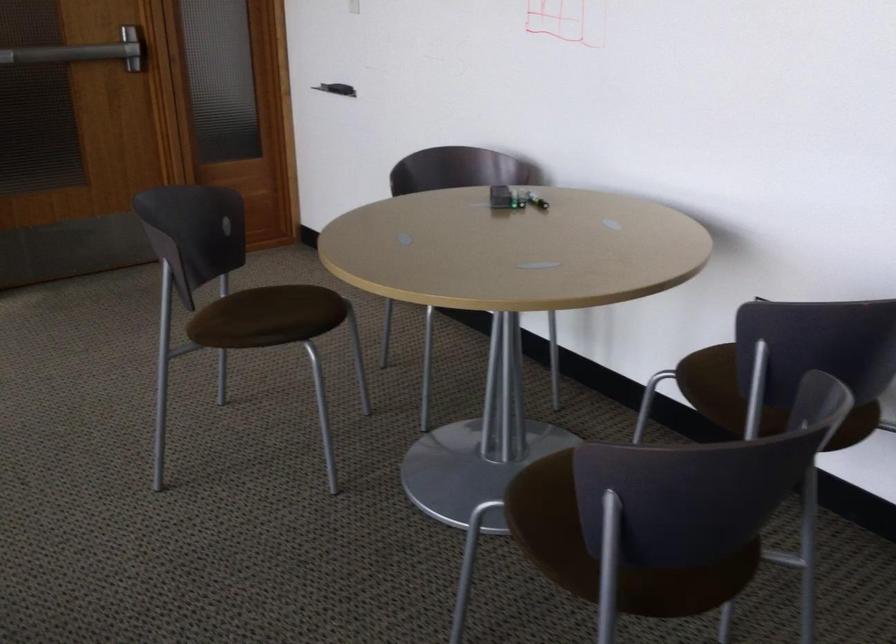
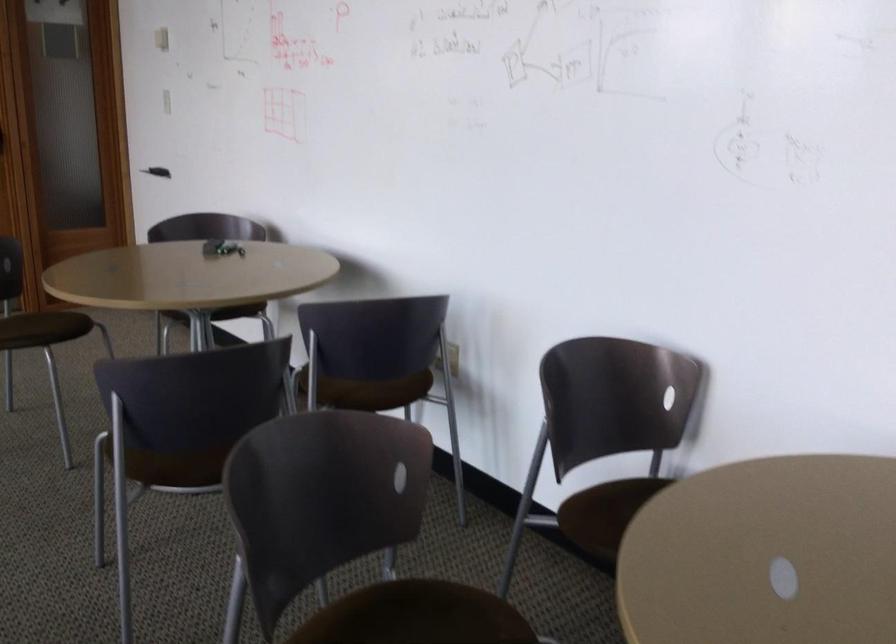
The point at (764,424) is marked in the first image. Where is the corresponding point in the second image?

(347, 392)